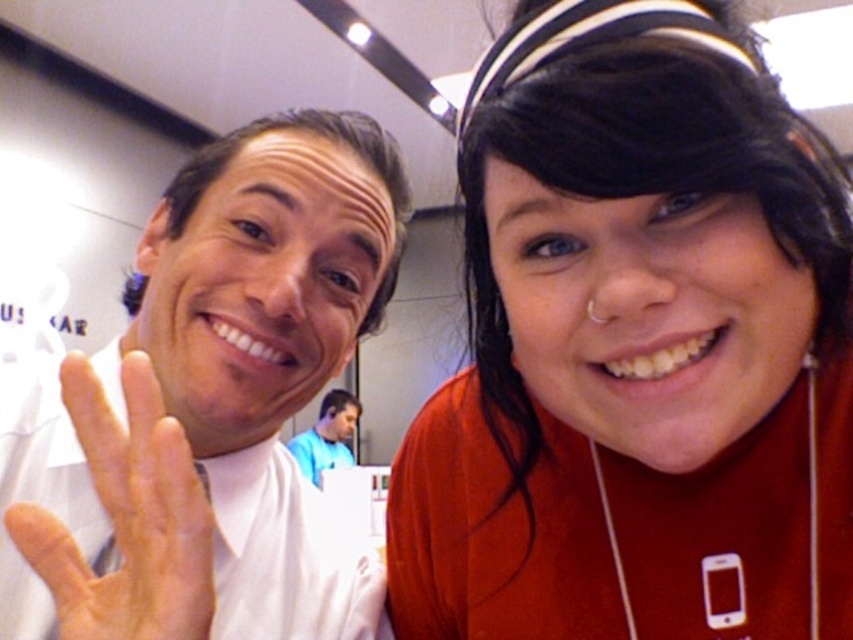
Which is below, white matte hand at center or silver metallic earphone at upper right?

white matte hand at center is lower down.

Who is positioned more to the left, white matte hand at center or silver metallic earphone at upper right?

Positioned to the left is white matte hand at center.

Is point (132, 465) behind point (590, 316)?

No, it is not.

This screenshot has width=853, height=640. In order to click on white matte hand at center in this screenshot , I will do `click(126, 516)`.

Between white matte t-shirt at left and silver metallic earphone at upper right, which one has more height?

white matte t-shirt at left is taller.

Who is positioned more to the right, white matte t-shirt at left or silver metallic earphone at upper right?

Positioned to the right is silver metallic earphone at upper right.

What do you see at coordinates (207, 406) in the screenshot? Image resolution: width=853 pixels, height=640 pixels. I see `white matte t-shirt at left` at bounding box center [207, 406].

In order to click on white matte t-shirt at left in this screenshot , I will do `click(207, 406)`.

Does white matte t-shirt at left have a greater width compared to white matte hand at center?

Yes.

Is white matte t-shirt at left further to the viewer compared to white matte hand at center?

Yes, white matte t-shirt at left is further from the viewer.

You are a GUI agent. You are given a task and a screenshot of the screen. Output one action in this format:
    pyautogui.click(x=<x>, y=<y>)
    Task: Click on the white matte t-shirt at left
    This screenshot has width=853, height=640.
    Given the screenshot: What is the action you would take?
    pyautogui.click(x=207, y=406)